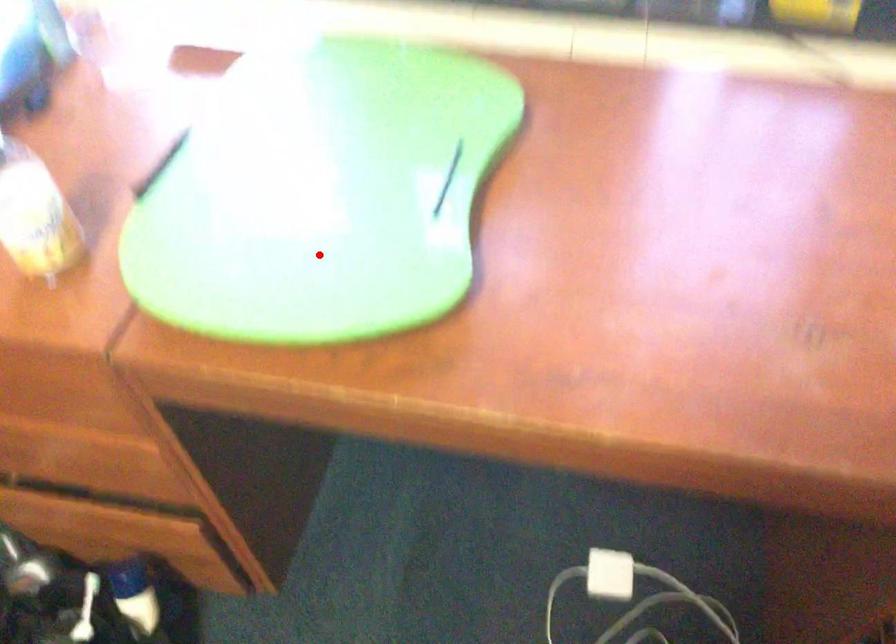
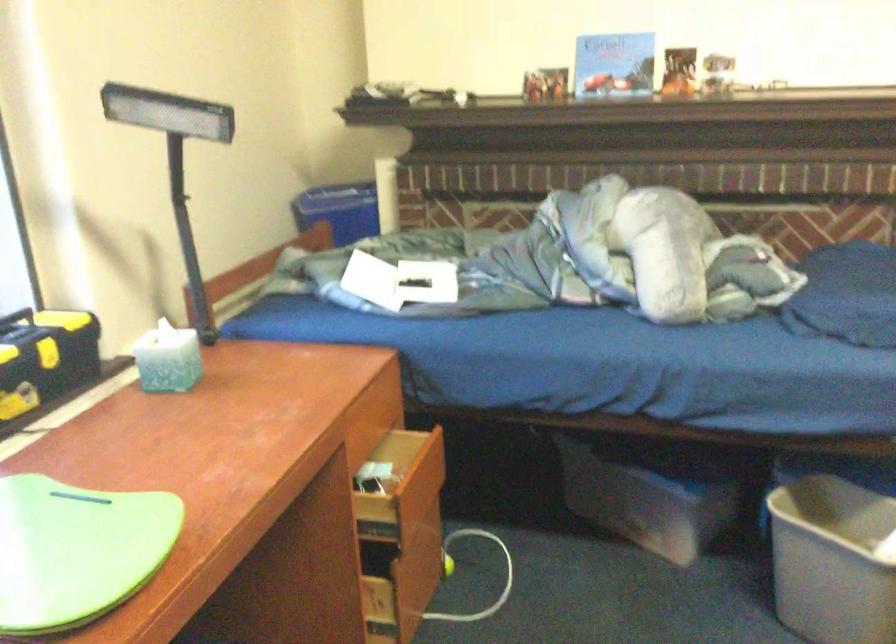
The point at the highlighted location is marked in the first image. Where is the corresponding point in the second image?

(76, 550)